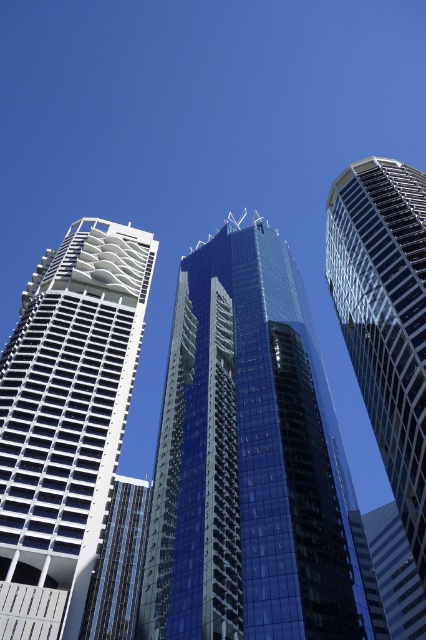
Can you confirm if shiny glass skyscraper at center is positioned to the left of glassy reflective skyscraper at right?

Correct, you'll find shiny glass skyscraper at center to the left of glassy reflective skyscraper at right.

You are a GUI agent. You are given a task and a screenshot of the screen. Output one action in this format:
    pyautogui.click(x=<x>, y=<y>)
    Task: Click on the shiny glass skyscraper at center
    The width and height of the screenshot is (426, 640).
    Given the screenshot: What is the action you would take?
    pyautogui.click(x=252, y=465)

Is shiny glass skyscraper at center to the left of white lattice tower at left from the viewer's perspective?

No, shiny glass skyscraper at center is not to the left of white lattice tower at left.

What do you see at coordinates (252, 465) in the screenshot? This screenshot has height=640, width=426. I see `shiny glass skyscraper at center` at bounding box center [252, 465].

What are the coordinates of `shiny glass skyscraper at center` in the screenshot? It's located at [x=252, y=465].

Does white lattice tower at left lie in front of glassy reflective skyscraper at right?

Yes, white lattice tower at left is closer to the viewer.

Does white lattice tower at left appear on the right side of glassy reflective skyscraper at right?

No, white lattice tower at left is not to the right of glassy reflective skyscraper at right.

I want to click on white lattice tower at left, so click(66, 419).